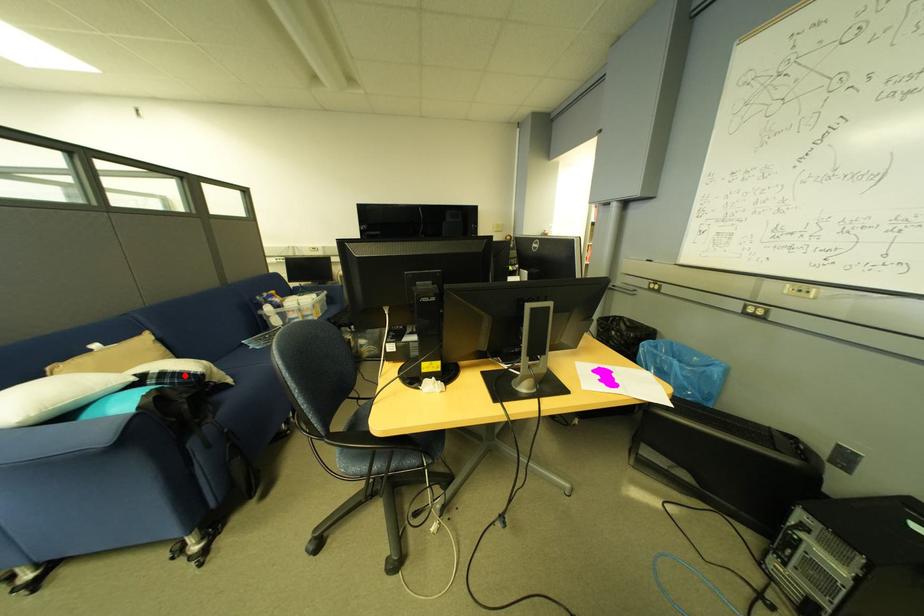
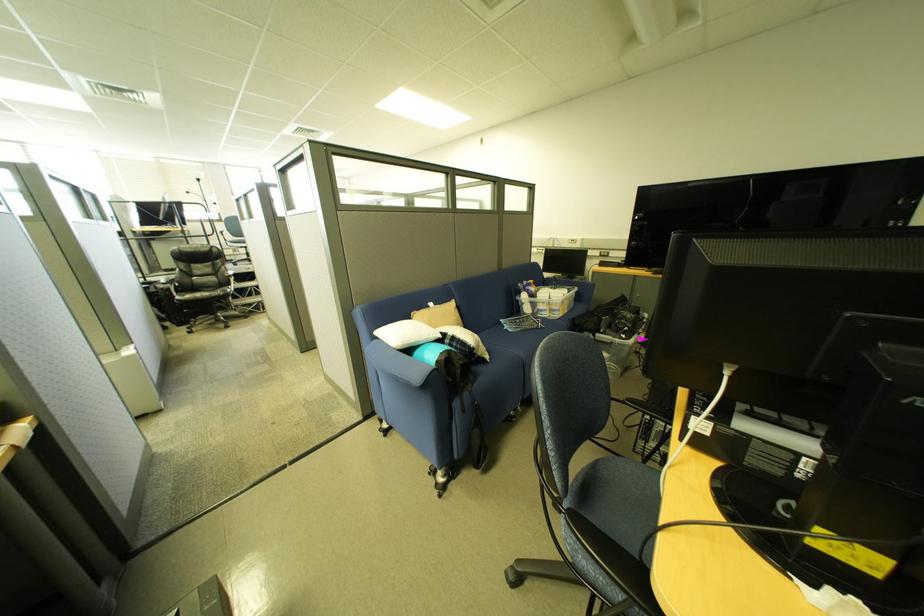
Question: I am providing you with two images of the same scene from different viewpoints. A red point is marked on the first image. Can you still see the location of the red point in image 2?

Choices:
 (A) Yes
 (B) No

Answer: (A)